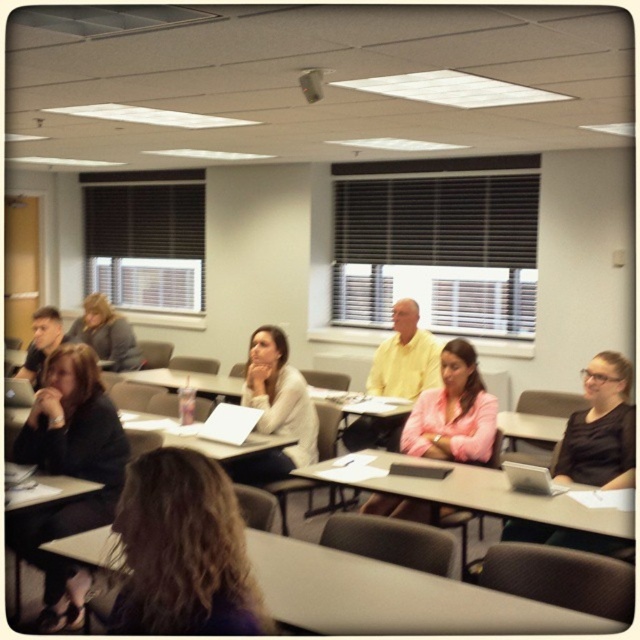
Question: Does pink matte jacket at center come in front of matte plastic table at center?

Choices:
 (A) yes
 (B) no

Answer: (A)

Question: Considering the relative positions of smooth gray table at center and matte plastic table at center in the image provided, where is smooth gray table at center located with respect to matte plastic table at center?

Choices:
 (A) above
 (B) below

Answer: (B)

Question: Where is smooth gray table at center located in relation to white plastic table at center in the image?

Choices:
 (A) left
 (B) right

Answer: (B)

Question: Which object is closer to the camera taking this photo?

Choices:
 (A) matte gray table at center
 (B) light brown hair at center
 (C) black matte shirt at lower right
 (D) yellow matte shirt at center

Answer: (A)

Question: Estimate the real-world distances between objects in this image. Which object is closer to the matte black jacket at left?

Choices:
 (A) pink matte jacket at center
 (B) white plastic table at center
 (C) black matte shirt at lower right

Answer: (B)

Question: Which of the following is the closest to the observer?

Choices:
 (A) (49, 477)
 (B) (579, 614)

Answer: (B)